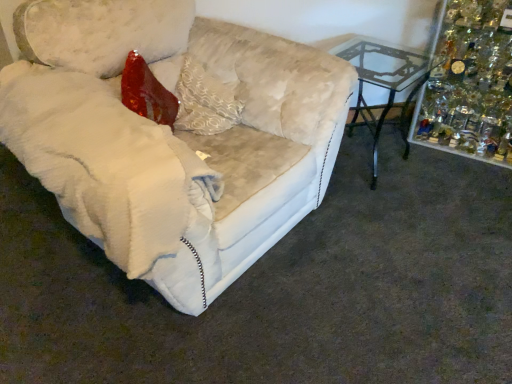
Question: Is white plush couch at left wider or thinner than shiny glass ornaments at upper right?

Choices:
 (A) thin
 (B) wide

Answer: (B)

Question: From a real-world perspective, is white plush couch at left positioned above or below shiny glass ornaments at upper right?

Choices:
 (A) below
 (B) above

Answer: (B)

Question: Based on their relative distances, which object is farther from the clear glass table at center right?

Choices:
 (A) white textured pillow at center
 (B) white plush couch at left
 (C) shiny glass ornaments at upper right

Answer: (A)

Question: Considering the real-world distances, which object is closest to the clear glass table at center right?

Choices:
 (A) shiny glass ornaments at upper right
 (B) white plush couch at left
 (C) white textured pillow at center

Answer: (A)